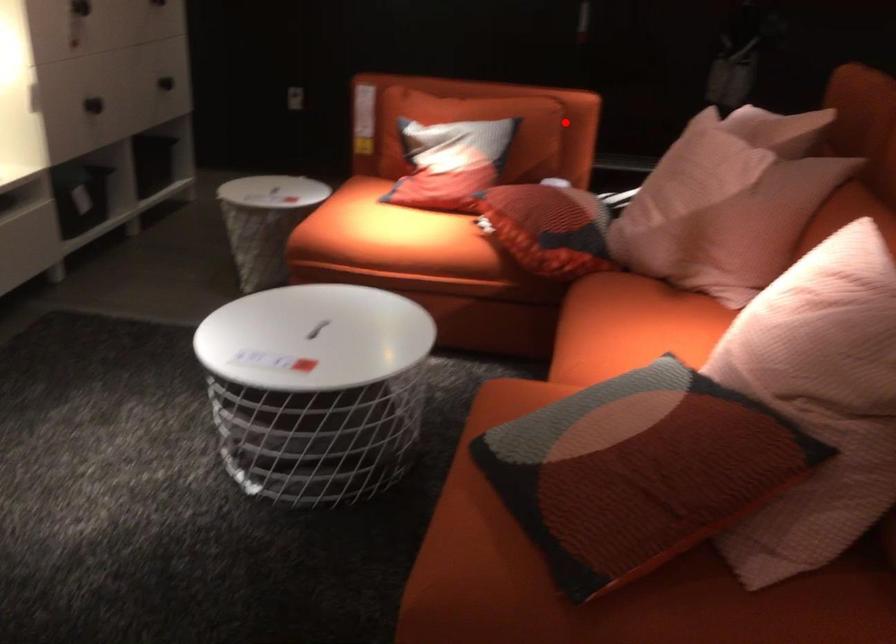
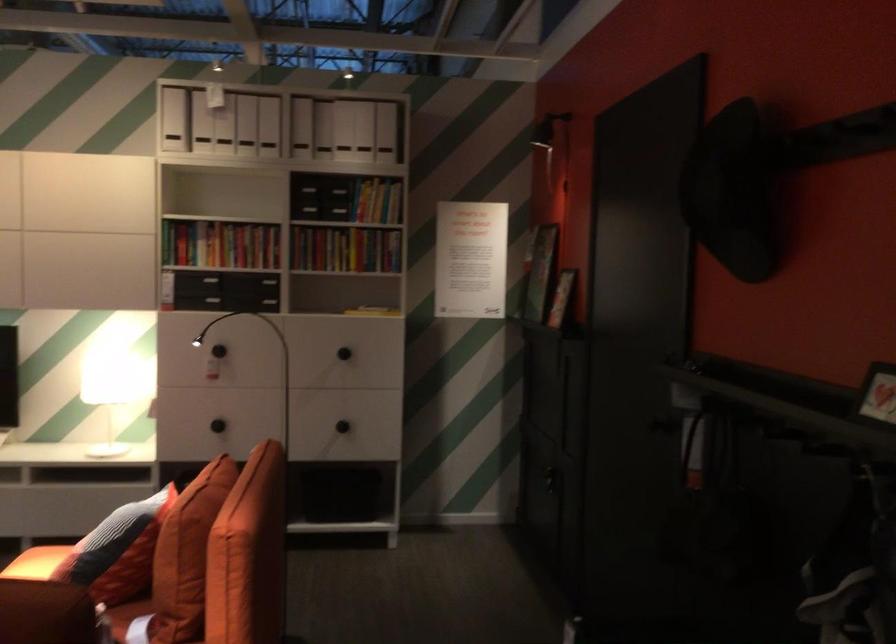
Question: I am providing you with two images of the same scene from different viewpoints. A red point is shown in image1. For the corresponding object point in image2, is it positioned nearer or farther from the camera?

Choices:
 (A) Nearer
 (B) Farther

Answer: (A)